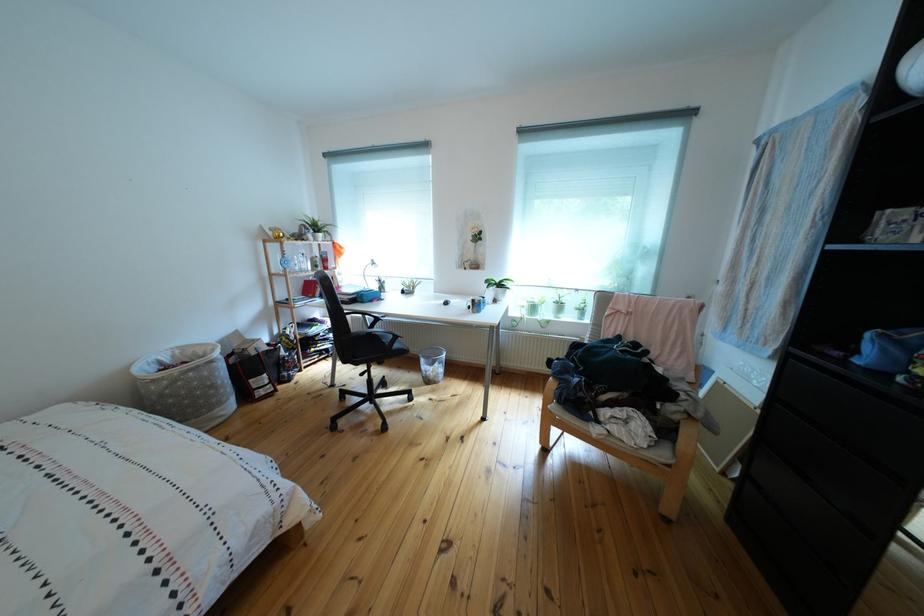
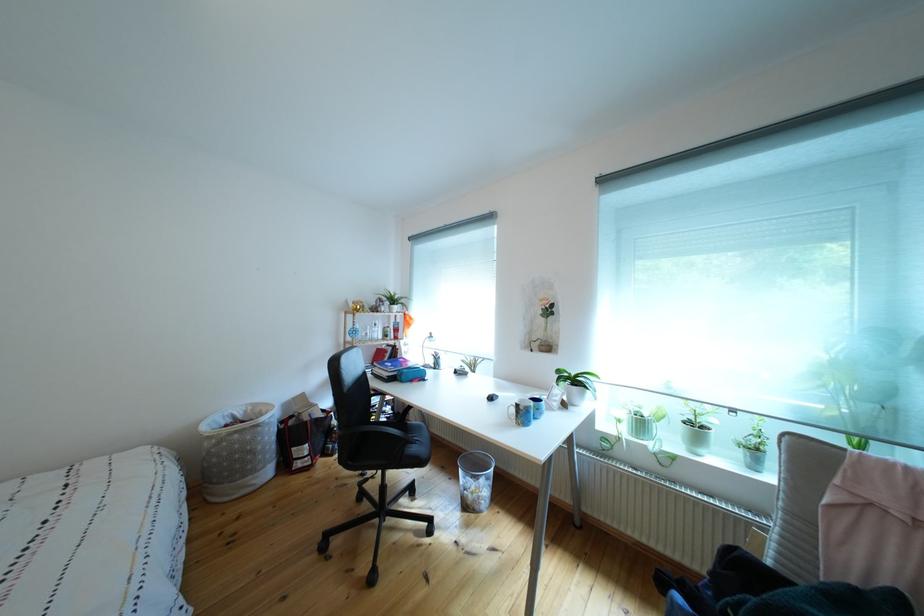
Find the pixel in the second image that matches pixel 295 359 in the first image.

(346, 428)